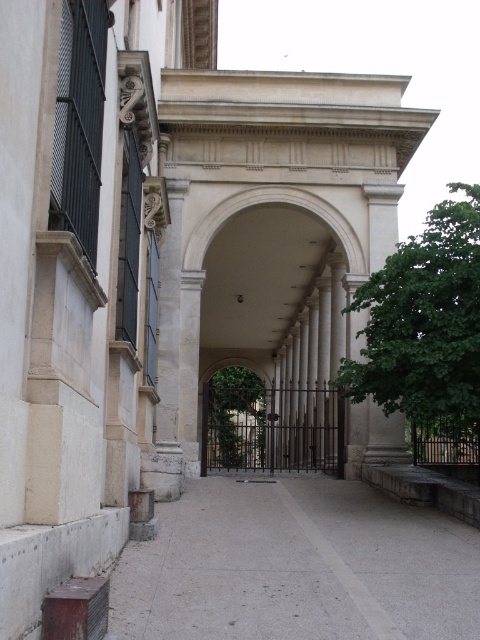
Who is more forward, (207, 413) or (272, 444)?

Positioned in front is point (207, 413).

Between white stone archway at center and green metal gate at center, which one has more height?

white stone archway at center

Is point (351, 328) closer to camera compared to point (240, 380)?

Yes.

Where is `white stone archway at center`? The width and height of the screenshot is (480, 640). white stone archway at center is located at coordinates (275, 323).

Which is above, white stone archway at center or gray concrete pavement at center?

white stone archway at center is higher up.

Where is `white stone archway at center`? The height and width of the screenshot is (640, 480). white stone archway at center is located at coordinates (275, 323).

How distant is gray concrete pavement at center from green metal gate at center?

72.50 feet

Who is lower down, gray concrete pavement at center or green metal gate at center?

green metal gate at center

Does point (228, 529) lie behind point (239, 451)?

That is False.

Locate an element on the screen. This screenshot has height=640, width=480. gray concrete pavement at center is located at coordinates (297, 566).